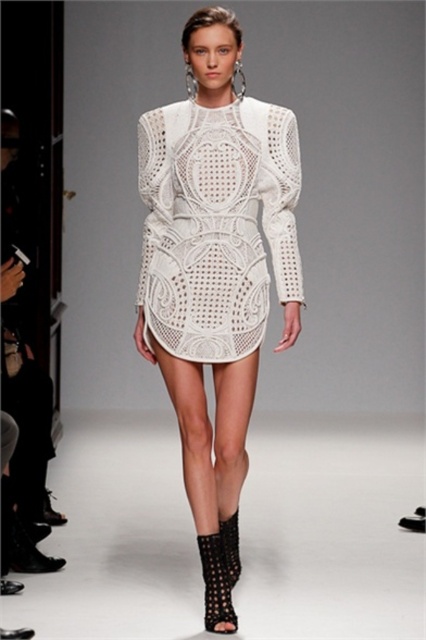
Who is more distant from viewer, (175, 259) or (232, 577)?

Point (232, 577)

Describe the element at coordinates (215, 253) in the screenshot. I see `white textured dress at center` at that location.

Identify the location of white textured dress at center. (215, 253).

Who is more forward, (206,218) or (206,596)?

Point (206,596) is more forward.

Can you confirm if white textured dress at center is bigger than black textured boot at lower center?

Correct, white textured dress at center is larger in size than black textured boot at lower center.

Image resolution: width=426 pixels, height=640 pixels. What do you see at coordinates (215, 253) in the screenshot?
I see `white textured dress at center` at bounding box center [215, 253].

Where is `white textured dress at center`? This screenshot has width=426, height=640. white textured dress at center is located at coordinates (215, 253).

Between white lace dress at center and black textured boot at lower center, which one appears on the right side from the viewer's perspective?

black textured boot at lower center is more to the right.

Who is positioned more to the left, white lace dress at center or black textured boot at lower center?

Positioned to the left is white lace dress at center.

Image resolution: width=426 pixels, height=640 pixels. Describe the element at coordinates (216, 225) in the screenshot. I see `white lace dress at center` at that location.

Image resolution: width=426 pixels, height=640 pixels. Find the location of `white lace dress at center`. white lace dress at center is located at coordinates (216, 225).